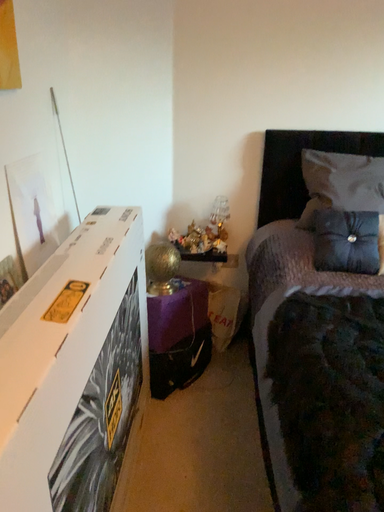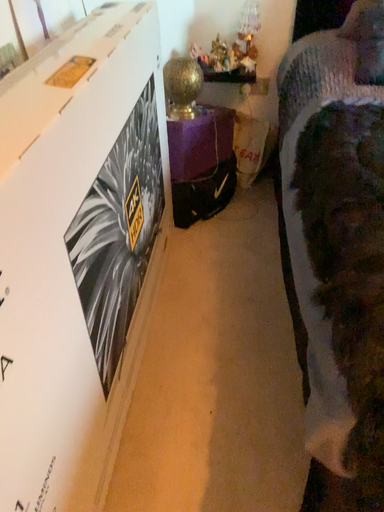
Question: How did the camera likely rotate when shooting the video?

Choices:
 (A) rotated downward
 (B) rotated upward

Answer: (A)